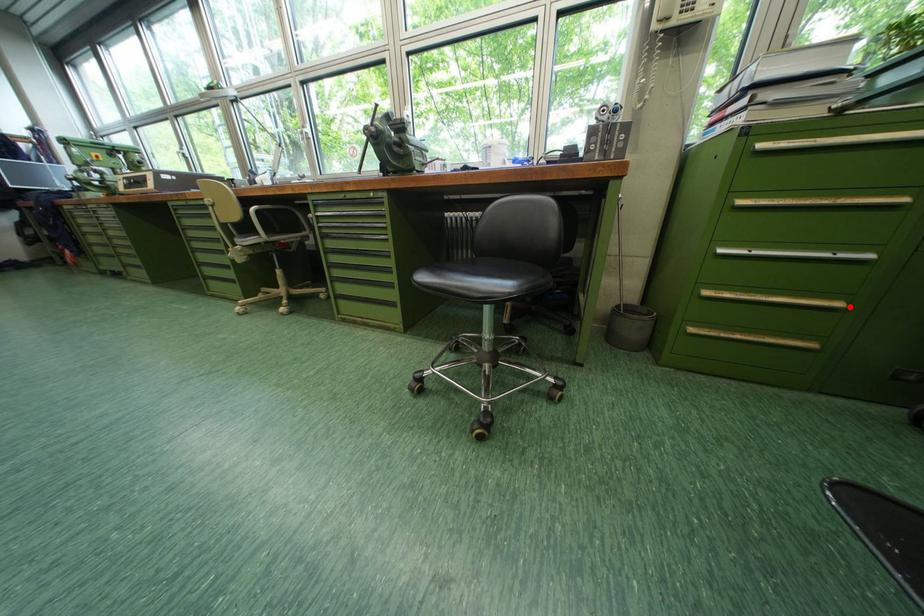
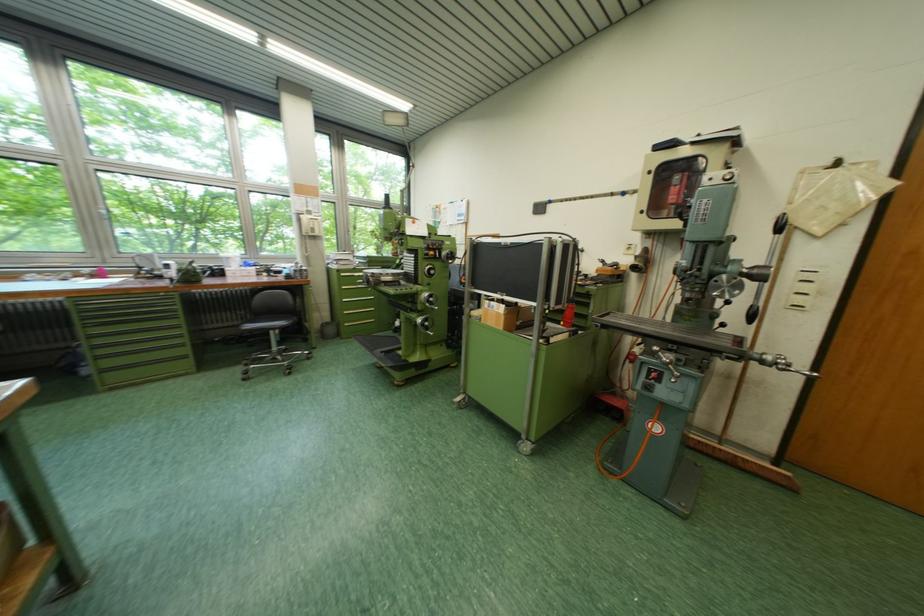
Locate, in the second image, the point that corresponds to the highlighted location in the first image.

(383, 312)